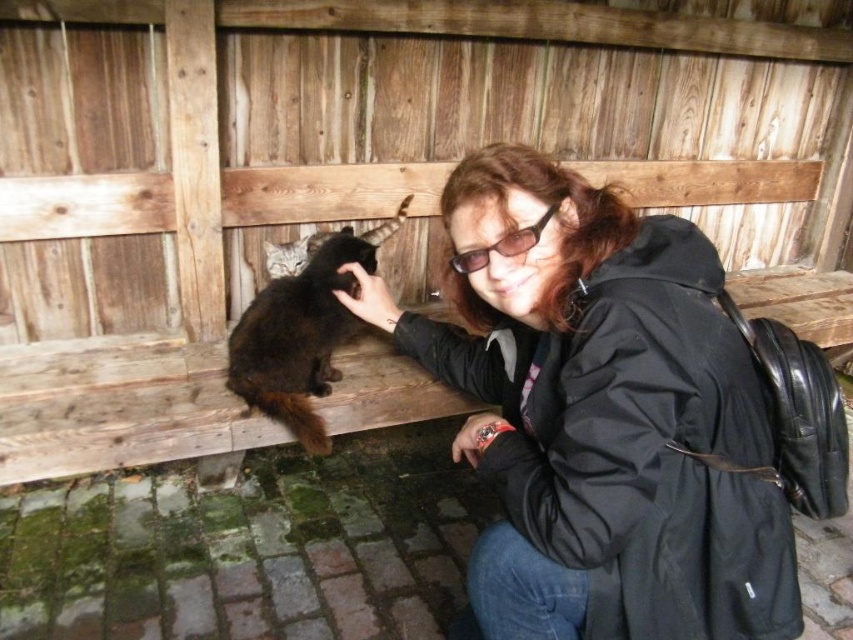
Can you confirm if black matte jacket at center is bigger than dark brown fur cat at upper left?

Yes, black matte jacket at center is bigger than dark brown fur cat at upper left.

Does black matte jacket at center appear on the left side of dark brown fur cat at upper left?

In fact, black matte jacket at center is to the right of dark brown fur cat at upper left.

Does point (503, 387) come closer to viewer compared to point (300, 424)?

Yes, point (503, 387) is in front of point (300, 424).

Find the location of a particular element. black matte jacket at center is located at coordinates (601, 413).